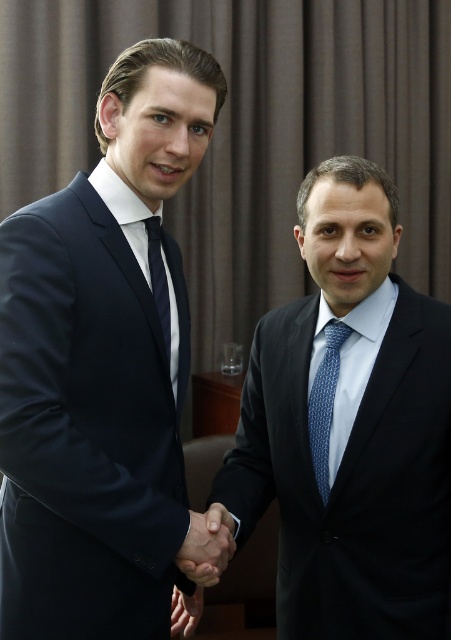
Question: Is navy blue suit at left smaller than blue dotted tie at right?

Choices:
 (A) yes
 (B) no

Answer: (B)

Question: Considering the relative positions of blue dotted tie at right and black matte hand at center in the image provided, where is blue dotted tie at right located with respect to black matte hand at center?

Choices:
 (A) left
 (B) right

Answer: (B)

Question: Which of the following is the farthest from the observer?

Choices:
 (A) black matte hand at center
 (B) matte blue tie at center
 (C) blue dotted tie at right

Answer: (C)

Question: Can you confirm if black matte suit at center is positioned above blue dotted tie at right?

Choices:
 (A) yes
 (B) no

Answer: (A)

Question: Which point is closer to the camera taking this photo?

Choices:
 (A) (174, 612)
 (B) (394, 451)
 (C) (214, 528)

Answer: (C)

Question: Which point is closer to the camera?

Choices:
 (A) [166, 284]
 (B) [193, 570]

Answer: (B)